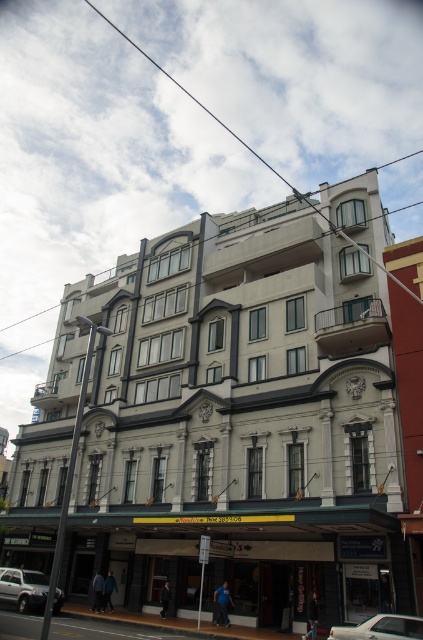
Question: Considering the real-world distances, which object is closest to the white smooth building at center?

Choices:
 (A) silver metallic car at lower left
 (B) silver metallic sedan at center

Answer: (A)

Question: Which object is closer to the camera taking this photo?

Choices:
 (A) silver metallic sedan at center
 (B) white smooth building at center
 (C) silver metallic car at lower left

Answer: (A)

Question: Does white smooth building at center have a larger size compared to silver metallic sedan at center?

Choices:
 (A) no
 (B) yes

Answer: (B)

Question: Which object is the farthest from the silver metallic sedan at center?

Choices:
 (A) silver metallic car at lower left
 (B) white smooth building at center

Answer: (B)

Question: From the image, what is the correct spatial relationship of silver metallic car at lower left in relation to silver metallic sedan at center?

Choices:
 (A) left
 (B) right

Answer: (A)

Question: Can you confirm if white smooth building at center is bigger than silver metallic car at lower left?

Choices:
 (A) no
 (B) yes

Answer: (B)